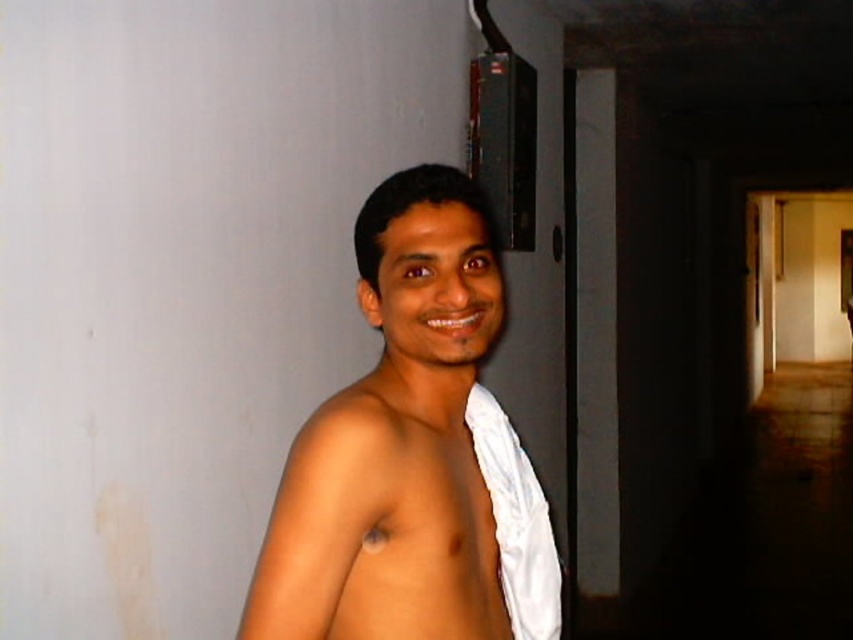
You are a photographer trying to capture the two white cloths in the scene. The camera can only focus on objects within a 4 inch range. Can both white cloth at center and white cloth at right be in focus at the same time?

The white cloth at center and white cloth at right are 4.58 inches apart from each other. Since the camera can only focus on objects within a 4 inch range, the distance between them exceeds the focus range. Therefore, both white cloth at center and white cloth at right cannot be in focus simultaneously.

You are standing in the hallway and see two points marked in the image. Which point, point (381, 484) or point (498, 429), is closer to you?

Point (381, 484) is closer to the viewer than point (498, 429).

You are a photographer setting up a shoot in this hallway. You have two white cloths available. The white cloth at center and the white cloth at right. Which one should you choose if you need a larger cloth to cover a mannequin?

The white cloth at center has a larger size compared to white cloth at right. Therefore, you should choose the white cloth at center to cover the mannequin.